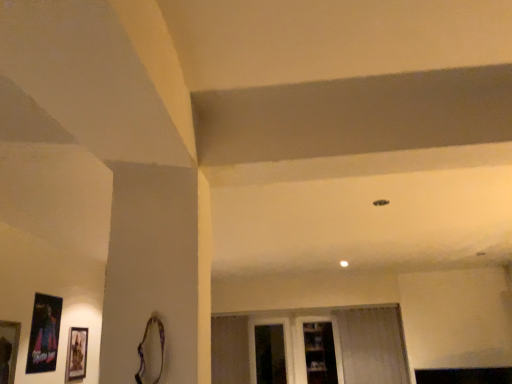
Question: Does clear glass shelves at center have a greater width compared to wooden picture frame at lower left, marked as the first picture frame in a front-to-back arrangement?

Choices:
 (A) no
 (B) yes

Answer: (B)

Question: Is clear glass shelves at center behind wooden picture frame at lower left, marked as the first picture frame in a front-to-back arrangement?

Choices:
 (A) no
 (B) yes

Answer: (B)

Question: Is the surface of clear glass shelves at center in direct contact with wooden picture frame at lower left, marked as the first picture frame in a front-to-back arrangement?

Choices:
 (A) no
 (B) yes

Answer: (A)

Question: Considering the relative positions of clear glass shelves at center and wooden picture frame at lower left, the third picture frame in the back-to-front sequence, in the image provided, is clear glass shelves at center to the right of wooden picture frame at lower left, the third picture frame in the back-to-front sequence, from the viewer's perspective?

Choices:
 (A) no
 (B) yes

Answer: (B)

Question: Considering the relative sizes of clear glass shelves at center and wooden picture frame at lower left, the third picture frame in the back-to-front sequence, in the image provided, is clear glass shelves at center shorter than wooden picture frame at lower left, the third picture frame in the back-to-front sequence,?

Choices:
 (A) yes
 (B) no

Answer: (B)

Question: Visually, is white sheer curtain at lower right positioned to the left or to the right of transparent glass window at center?

Choices:
 (A) left
 (B) right

Answer: (B)

Question: From the image's perspective, is white sheer curtain at lower right above or below transparent glass window at center?

Choices:
 (A) above
 (B) below

Answer: (A)

Question: Is point (348, 360) positioned closer to the camera than point (257, 367)?

Choices:
 (A) closer
 (B) farther

Answer: (A)

Question: From a real-world perspective, is white sheer curtain at lower right physically located above or below transparent glass window at center?

Choices:
 (A) below
 (B) above

Answer: (A)

Question: Would you say transparent glass door at center is to the left or to the right of metallic poster at left, which appears as the second picture frame when viewed from the front, in the picture?

Choices:
 (A) left
 (B) right

Answer: (B)

Question: From a real-world perspective, is transparent glass door at center above or below metallic poster at left, which appears as the second picture frame when viewed from the front?

Choices:
 (A) below
 (B) above

Answer: (A)

Question: From the image's perspective, is transparent glass door at center positioned above or below metallic poster at left, marked as the second picture frame in a back-to-front arrangement?

Choices:
 (A) above
 (B) below

Answer: (B)

Question: Relative to metallic poster at left, marked as the second picture frame in a back-to-front arrangement, is transparent glass door at center in front or behind?

Choices:
 (A) front
 (B) behind

Answer: (B)

Question: Looking at the image, does matte black picture frame at lower left, which is the third picture frame in front-to-back order, seem bigger or smaller compared to metallic poster at left, marked as the second picture frame in a back-to-front arrangement?

Choices:
 (A) small
 (B) big

Answer: (A)

Question: From a real-world perspective, is matte black picture frame at lower left, the 1th picture frame in the back-to-front sequence, positioned above or below metallic poster at left, which appears as the second picture frame when viewed from the front?

Choices:
 (A) below
 (B) above

Answer: (A)